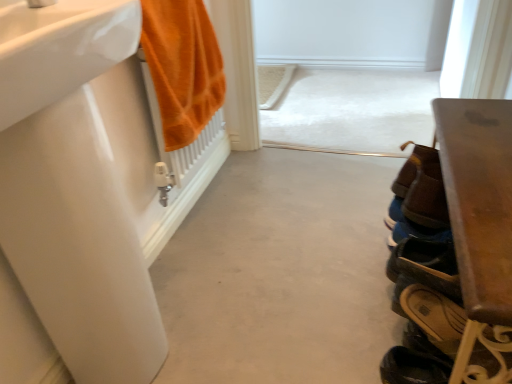
Where is `blank space situated above beige leather sandals at lower right, positioned as the second footwear in top-to-bottom order (from a real-world perspective)`? This screenshot has width=512, height=384. blank space situated above beige leather sandals at lower right, positioned as the second footwear in top-to-bottom order (from a real-world perspective) is located at coordinates (436, 295).